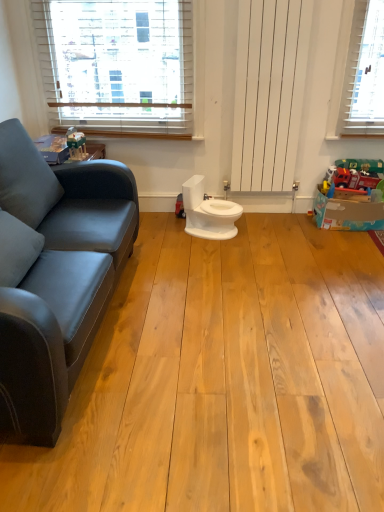
Question: Is white glossy toilet at center bigger or smaller than white wooden blinds at upper left?

Choices:
 (A) small
 (B) big

Answer: (A)

Question: In the image, is white glossy toilet at center positioned in front of or behind white wooden blinds at upper left?

Choices:
 (A) behind
 (B) front

Answer: (B)

Question: Which is nearer to the white wooden blinds at upper left?

Choices:
 (A) matte plastic toy at upper left, which appears as the 2th toy when viewed from the right
 (B) white glossy toilet at center
 (C) matte red fire truck at right, acting as the second toy starting from the left

Answer: (A)

Question: Considering the real-world distances, which object is closest to the white wooden blinds at upper left?

Choices:
 (A) white glossy toilet at center
 (B) matte red fire truck at right, placed as the first toy when sorted from back to front
 (C) matte plastic toy at upper left, which is counted as the 2th toy, starting from the back

Answer: (C)